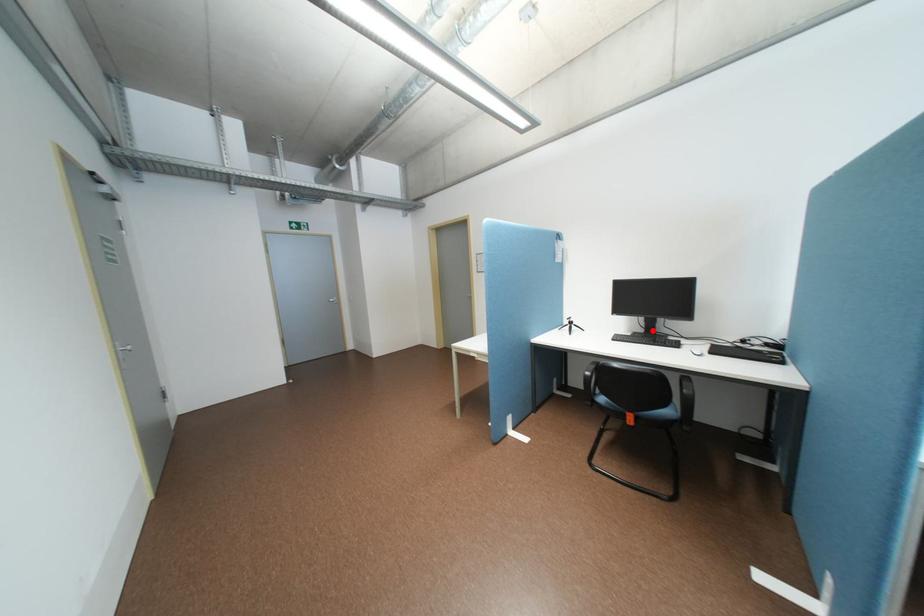
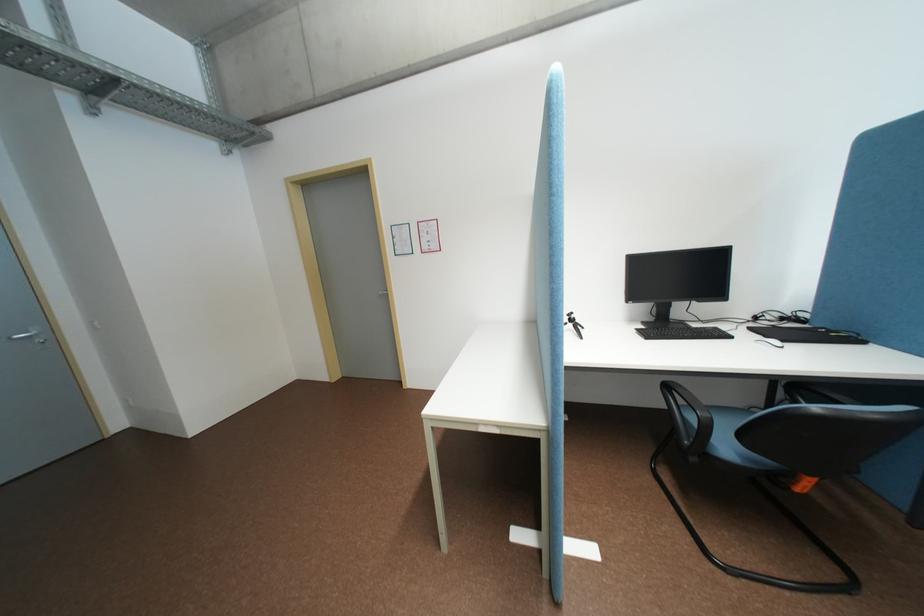
Where in the second image is the point corresponding to the highlighted location from the first image?

(662, 318)